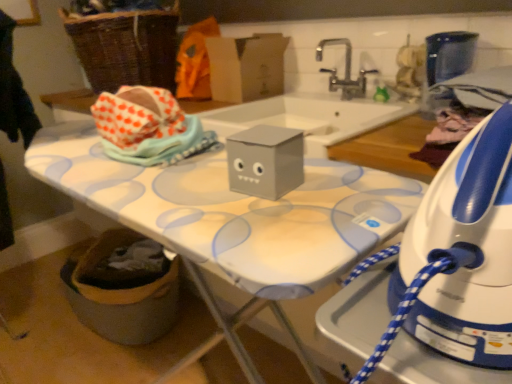
Question: Is silver metallic faucet at upper center at the back of white plastic iron at right?

Choices:
 (A) no
 (B) yes

Answer: (A)

Question: Is white plastic iron at right shorter than silver metallic faucet at upper center?

Choices:
 (A) no
 (B) yes

Answer: (A)

Question: Is white plastic iron at right to the right of silver metallic faucet at upper center from the viewer's perspective?

Choices:
 (A) yes
 (B) no

Answer: (A)

Question: Can silver metallic faucet at upper center be found inside white plastic iron at right?

Choices:
 (A) no
 (B) yes

Answer: (A)

Question: Considering the relative sizes of white plastic iron at right and silver metallic faucet at upper center in the image provided, is white plastic iron at right bigger than silver metallic faucet at upper center?

Choices:
 (A) no
 (B) yes

Answer: (B)

Question: Visually, is orange fabric at upper center positioned to the left or to the right of cardboard box at upper center?

Choices:
 (A) right
 (B) left

Answer: (B)

Question: Is orange fabric at upper center bigger or smaller than cardboard box at upper center?

Choices:
 (A) big
 (B) small

Answer: (A)

Question: Is orange fabric at upper center wider or thinner than cardboard box at upper center?

Choices:
 (A) wide
 (B) thin

Answer: (B)

Question: Relative to cardboard box at upper center, is orange fabric at upper center in front or behind?

Choices:
 (A) behind
 (B) front

Answer: (A)

Question: Relative to silver metallic faucet at upper center, is cardboard box at upper center in front or behind?

Choices:
 (A) behind
 (B) front

Answer: (A)

Question: Would you say cardboard box at upper center is to the left or to the right of silver metallic faucet at upper center in the picture?

Choices:
 (A) left
 (B) right

Answer: (A)

Question: Considering the positions of cardboard box at upper center and silver metallic faucet at upper center in the image, is cardboard box at upper center wider or thinner than silver metallic faucet at upper center?

Choices:
 (A) thin
 (B) wide

Answer: (A)

Question: In terms of height, does cardboard box at upper center look taller or shorter compared to silver metallic faucet at upper center?

Choices:
 (A) short
 (B) tall

Answer: (B)

Question: Looking at the image, does silver metallic faucet at upper center seem bigger or smaller compared to cardboard box at upper center?

Choices:
 (A) small
 (B) big

Answer: (A)

Question: In terms of height, does silver metallic faucet at upper center look taller or shorter compared to cardboard box at upper center?

Choices:
 (A) tall
 (B) short

Answer: (B)